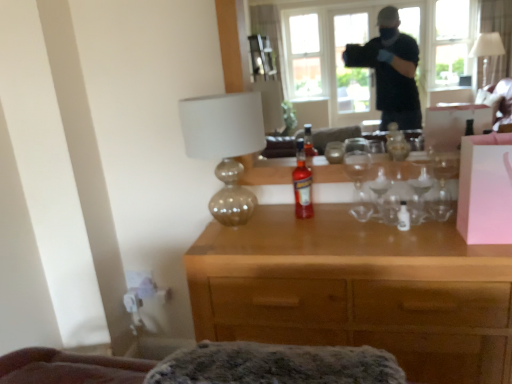
Where is `vacant area that lies to the right of matte gold lamp at center`? This screenshot has height=384, width=512. vacant area that lies to the right of matte gold lamp at center is located at coordinates click(x=306, y=230).